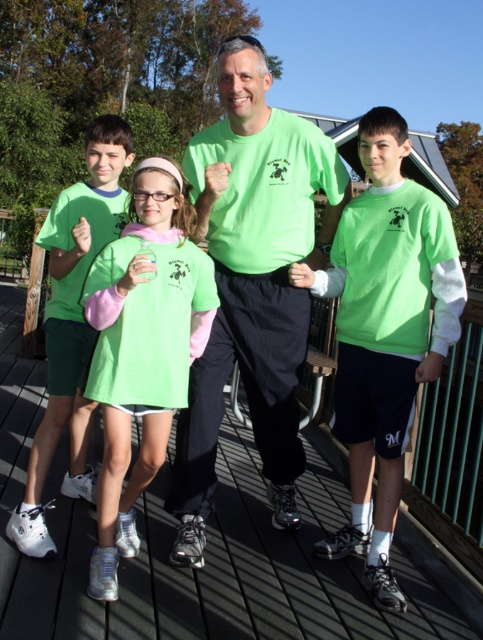
Is point (400, 330) positioned in front of point (172, 236)?

No.

From the picture: Does matte green shirt at right appear on the right side of matte green shirt at center?

Yes, matte green shirt at right is to the right of matte green shirt at center.

Between point (375, 582) and point (129, 360), which one is positioned behind?

Point (375, 582)

This screenshot has height=640, width=483. I want to click on matte green shirt at right, so click(x=384, y=333).

Which is more to the left, matte green t-shirt at center or matte green shorts at center?

matte green shorts at center

How distant is matte green t-shirt at center from matte green shorts at center?

matte green t-shirt at center is 33.12 inches away from matte green shorts at center.

Between point (238, 164) and point (119, 134), which one is positioned in front?

Point (238, 164) is more forward.

You are a GUI agent. You are given a task and a screenshot of the screen. Output one action in this format:
    pyautogui.click(x=<x>, y=<y>)
    Task: Click on the matte green t-shirt at center
    Image resolution: width=483 pixels, height=640 pixels.
    Given the screenshot: What is the action you would take?
    pyautogui.click(x=252, y=284)

Describe the element at coordinates (142, 348) in the screenshot. I see `matte green shirt at center` at that location.

Which is below, matte green shirt at center or matte green shorts at center?

matte green shirt at center is lower down.

Which is in front, point (96, 570) or point (79, 481)?

Point (96, 570)

The width and height of the screenshot is (483, 640). I want to click on matte green shirt at center, so click(x=142, y=348).